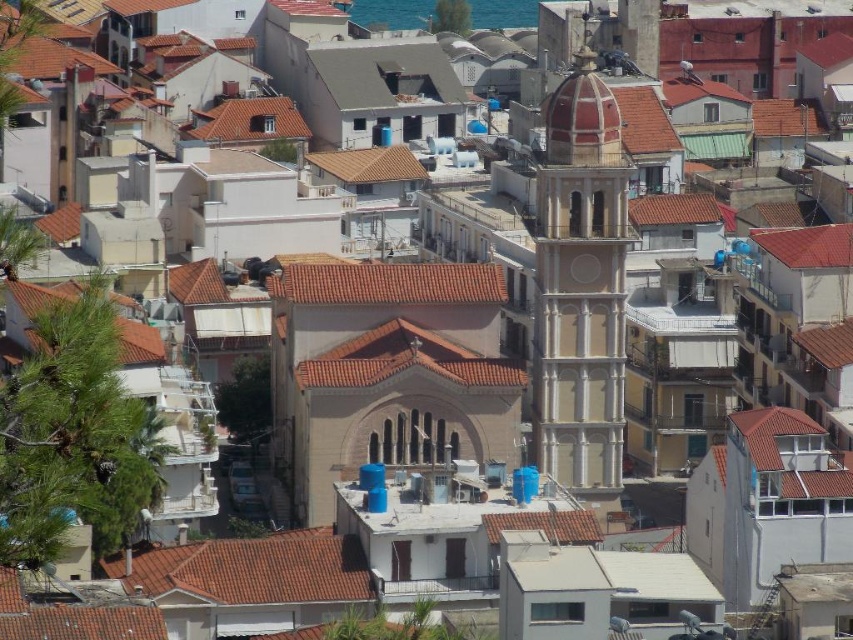
Question: Is the position of brown textured church at center more distant than that of matte pink tower at center?

Choices:
 (A) no
 (B) yes

Answer: (A)

Question: From the image, what is the correct spatial relationship of brown textured church at center in relation to matte pink tower at center?

Choices:
 (A) below
 (B) above

Answer: (A)

Question: Does brown textured church at center appear on the right side of matte pink tower at center?

Choices:
 (A) yes
 (B) no

Answer: (B)